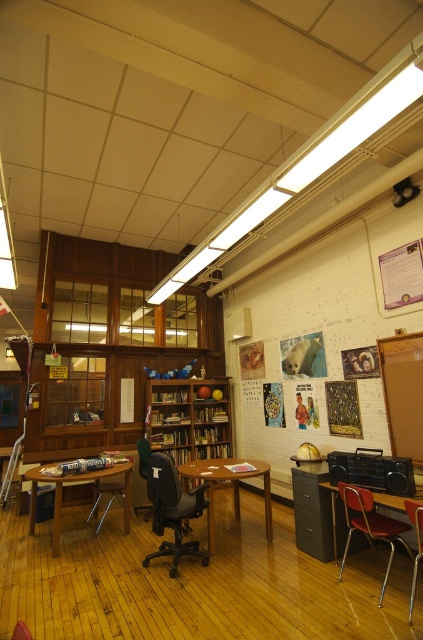
You are standing at the entrance of the study room and want to sit in the metallic swivel chair at lower right. Based on the room layout, can you estimate where you should walk to reach it?

The metallic swivel chair at lower right is located at point 0.822 on the x axis and 0.875 on the y axis, so you should walk towards the lower right area of the room to reach it.

From the picture: You are a person sitting in the green fabric office chair at center. You want to reach a book on the wooden bookshelf at center. Can you easily reach it without moving from your seat?

The wooden bookshelf at center is located above the green fabric office chair at center, so it is positioned higher up. This means the book on the wooden bookshelf at center might be out of arm s reach if it is placed higher than the chair. You may need to stand or use a tool to reach it.

You are organizing a small event in the study area and need to place a large poster on the wall. The poster requires a flat surface that can accommodate its size. Which object between the metallic swivel chair at lower right and the metallic at right would be more suitable to move to make space?

The metallic swivel chair at lower right is larger in size compared to the metallic at right, so moving the metallic swivel chair at lower right would free up more space for the poster.